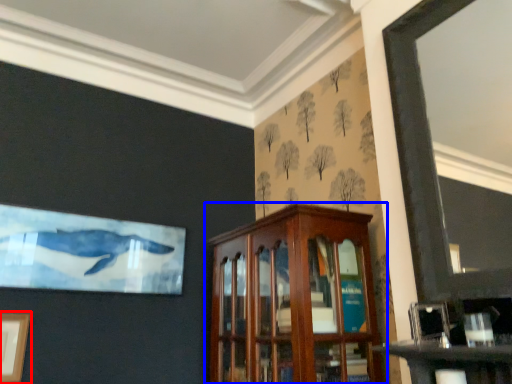
Question: Among these objects, which one is farthest to the camera, picture frame (highlighted by a red box) or cabinetry (highlighted by a blue box)?

Choices:
 (A) picture frame
 (B) cabinetry

Answer: (A)